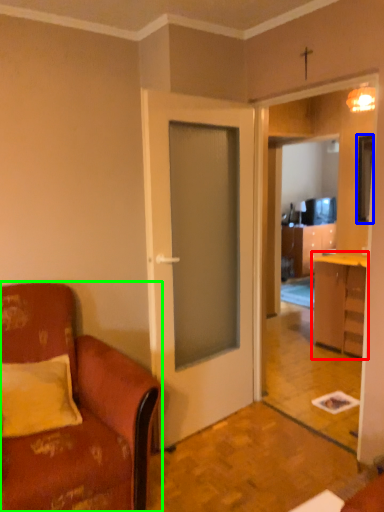
Question: Estimate the real-world distances between objects in this image. Which object is farther from cabinetry (highlighted by a red box), television (highlighted by a blue box) or chair (highlighted by a green box)?

Choices:
 (A) television
 (B) chair

Answer: (B)